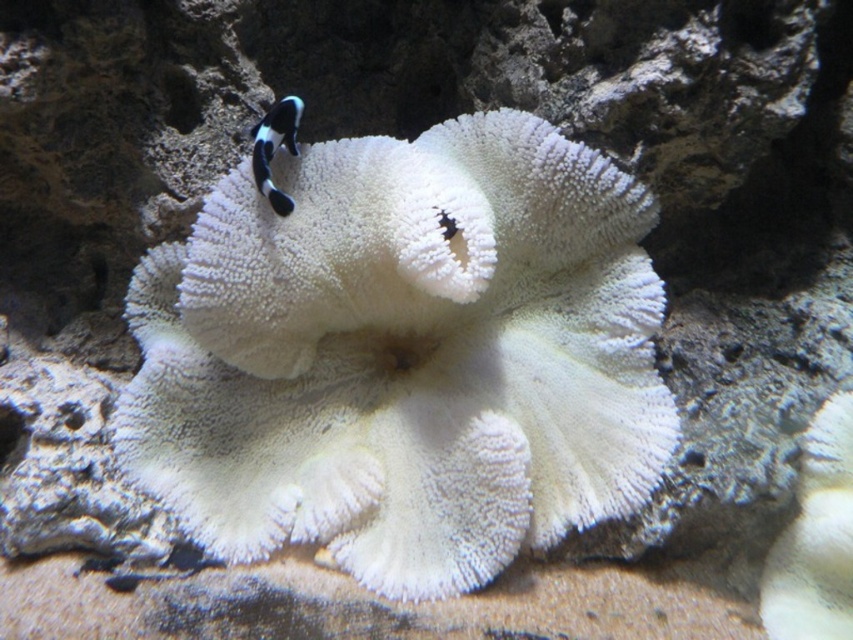
Question: Does white coral at center appear over black and white striped fish at center?

Choices:
 (A) no
 (B) yes

Answer: (A)

Question: Which object is farther from the camera taking this photo?

Choices:
 (A) black and white striped fish at center
 (B) white coral at center

Answer: (A)

Question: Does white coral at center lie in front of black and white striped fish at center?

Choices:
 (A) yes
 (B) no

Answer: (A)

Question: Which of the following is the closest to the observer?

Choices:
 (A) white coral at center
 (B) black and white striped fish at center

Answer: (A)

Question: Does white coral at center appear under black and white striped fish at center?

Choices:
 (A) yes
 (B) no

Answer: (A)